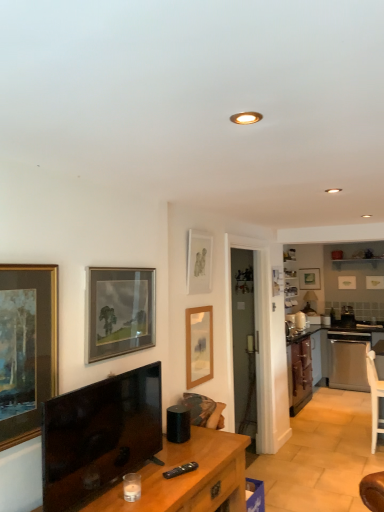
You are a GUI agent. You are given a task and a screenshot of the screen. Output one action in this format:
    pyautogui.click(x=<x>, y=<y>)
    Task: Click on the vacant area that is in front of black matte speaker at center, which is the 2th appliance in right-to-left order
    The image size is (384, 512).
    Given the screenshot: What is the action you would take?
    pyautogui.click(x=195, y=451)